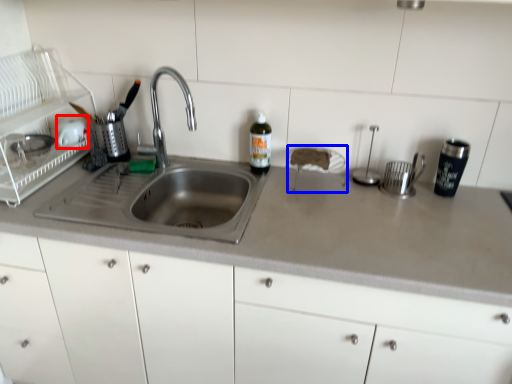
Question: Which object is further to the camera taking this photo, appliance (highlighted by a red box) or appliance (highlighted by a blue box)?

Choices:
 (A) appliance
 (B) appliance

Answer: (A)